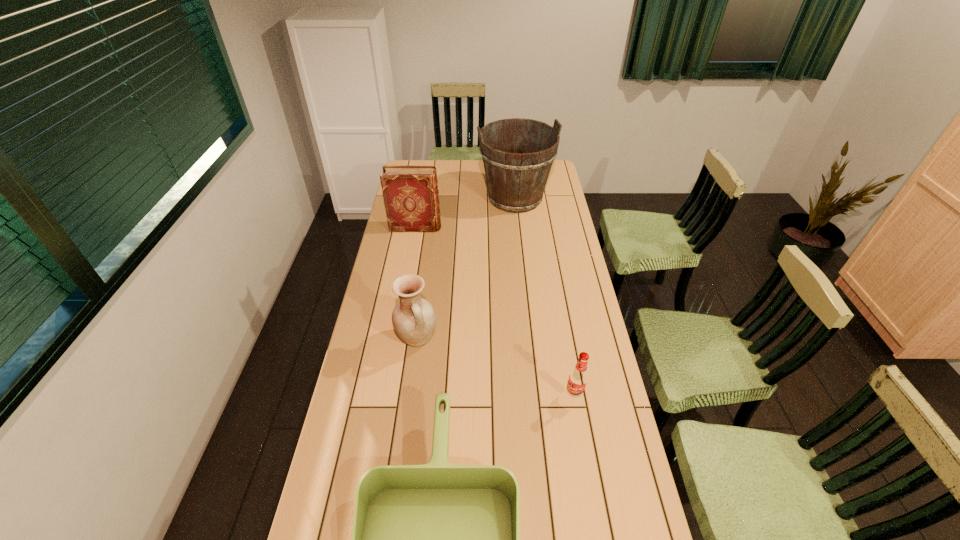
Where is `object located at the far edge`? Image resolution: width=960 pixels, height=540 pixels. object located at the far edge is located at coordinates (516, 181).

I want to click on hardback book present at the left edge, so coord(410,193).

Where is `pottery that is positioned at the left edge`? This screenshot has width=960, height=540. pottery that is positioned at the left edge is located at coordinates [x=413, y=318].

Locate an element on the screen. bucket that is positioned at the right edge is located at coordinates (516, 181).

You are a GUI agent. You are given a task and a screenshot of the screen. Output one action in this format:
    pyautogui.click(x=<x>, y=<y>)
    Task: Click on the root beer that is at the right edge
    
    Given the screenshot: What is the action you would take?
    pyautogui.click(x=578, y=378)

Identify the location of object located in the far right corner section of the desktop. Image resolution: width=960 pixels, height=540 pixels. (516, 181).

I want to click on vacant space at the far edge of the desktop, so click(445, 171).

This screenshot has width=960, height=540. I want to click on vacant area at the left edge of the desktop, so click(384, 394).

In the image, there is a desktop. Where is `free space at the right edge`? free space at the right edge is located at coordinates (563, 234).

The height and width of the screenshot is (540, 960). Find the location of `free area in between the tallest object and the fourth nearest object`. free area in between the tallest object and the fourth nearest object is located at coordinates (466, 213).